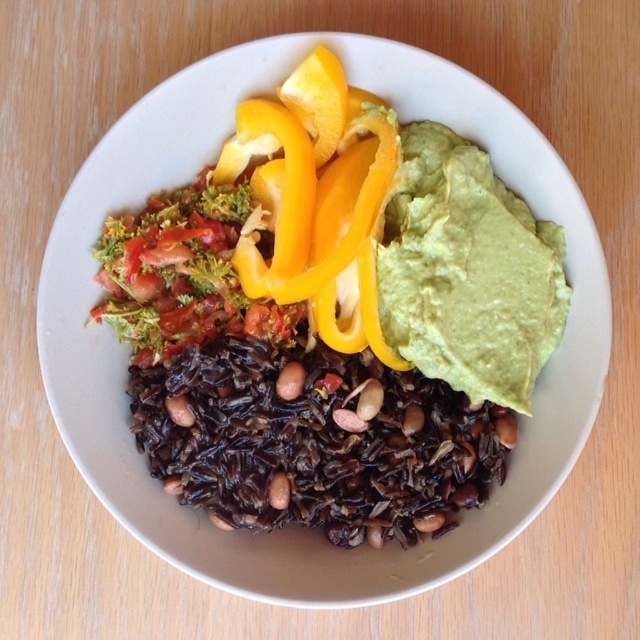
Is green creamy guacamole at upper right below yellow matte pepper at center?

Yes.

Who is positioned more to the left, green creamy guacamole at upper right or yellow matte pepper at center?

yellow matte pepper at center

Is point (422, 237) positioned in front of point (282, 198)?

Yes, it is in front of point (282, 198).

Image resolution: width=640 pixels, height=640 pixels. I want to click on green creamy guacamole at upper right, so click(x=467, y=272).

Who is lower down, yellow matte pepper at center or brown matte bean at center?

Positioned lower is brown matte bean at center.

Identify the location of yellow matte pepper at center. (317, 198).

Find the location of a particular element. The image size is (640, 640). yellow matte pepper at center is located at coordinates (317, 198).

Is point (403, 298) farther from camera compared to point (282, 392)?

Yes.

Where is `green creamy guacamole at upper right`? The width and height of the screenshot is (640, 640). green creamy guacamole at upper right is located at coordinates (467, 272).